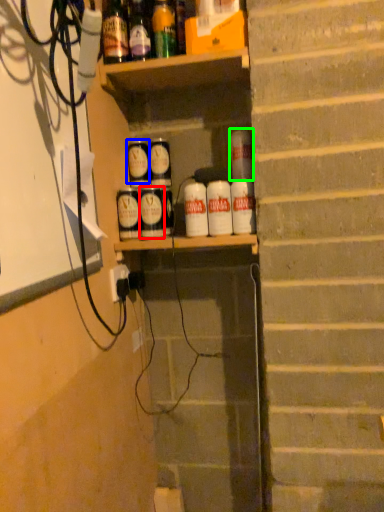
Question: Which object is the closest to the spray (highlighted by a red box)? Choose among these: spray (highlighted by a blue box) or beverage (highlighted by a green box).

Choices:
 (A) spray
 (B) beverage

Answer: (A)